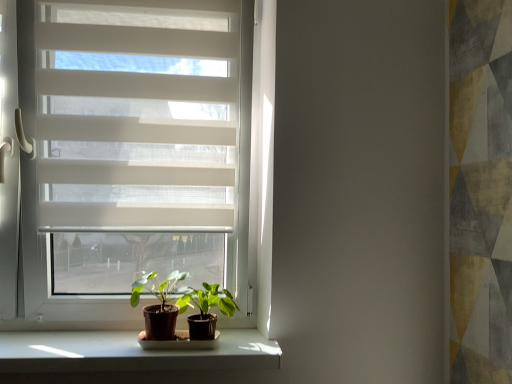
Identify the location of green matte plant at center, arranged as the second houseplant when viewed from the right. The width and height of the screenshot is (512, 384). (161, 303).

The image size is (512, 384). What do you see at coordinates (138, 119) in the screenshot? I see `white translucent blinds at upper left` at bounding box center [138, 119].

Find the location of a particular element. green matte plant at center, the second houseplant positioned from the left is located at coordinates (206, 309).

Identify the location of white matte window at center. This screenshot has height=384, width=512. (133, 155).

Where is `green matte plant at center, which is the 1th houseplant from left to right`? Image resolution: width=512 pixels, height=384 pixels. green matte plant at center, which is the 1th houseplant from left to right is located at coordinates (161, 303).

Is brown matte pot at lower center wider than white matte window at center?

No, brown matte pot at lower center is not wider than white matte window at center.

From the image's perspective, would you say brown matte pot at lower center is shown under white matte window at center?

Yes, from the image's perspective, brown matte pot at lower center is beneath white matte window at center.

There is a brown matte pot at lower center. Where is `window above it (from a real-world perspective)`? This screenshot has height=384, width=512. window above it (from a real-world perspective) is located at coordinates (133, 155).

Consider the image. Can you confirm if white smooth window sill at lower center is bigger than green matte plant at center, which is the 1th houseplant from left to right?

Yes.

Based on the photo, is white smooth window sill at lower center facing towards green matte plant at center, which is the 1th houseplant from left to right?

No, white smooth window sill at lower center is not aimed at green matte plant at center, which is the 1th houseplant from left to right.

From the white smooth window sill at lower center, count 2nd houseplants backward and point to it. Please provide its 2D coordinates.

[(161, 303)]

Is point (113, 363) positioned after point (172, 334)?

No.

Is white matte window at center looking in the opposite direction of green matte plant at center, which appears as the first houseplant when viewed from the right?

Correct, white matte window at center is looking away from green matte plant at center, which appears as the first houseplant when viewed from the right.

Between white matte window at center and green matte plant at center, the second houseplant positioned from the left, which one has larger width?

green matte plant at center, the second houseplant positioned from the left, is wider.

Does white matte window at center come behind green matte plant at center, the second houseplant positioned from the left?

Yes, white matte window at center is further from the camera.

Can you tell me how much white matte window at center and white translucent blinds at upper left differ in facing direction?

white matte window at center and white translucent blinds at upper left are facing 0.000987 degrees away from each other.

From a real-world perspective, which object rests below the other?

From a 3D spatial view, white matte window at center is below.

Is there a large distance between white matte window at center and white translucent blinds at upper left?

No, white matte window at center is not far away from white translucent blinds at upper left.

Is white matte window at center wider or thinner than white translucent blinds at upper left?

white matte window at center is wider than white translucent blinds at upper left.

Is brown matte pot at lower center completely or partially inside green matte plant at center, the second houseplant positioned from the left?

No, brown matte pot at lower center is not surrounded by green matte plant at center, the second houseplant positioned from the left.

Between green matte plant at center, which appears as the first houseplant when viewed from the right, and brown matte pot at lower center, which one appears on the right side from the viewer's perspective?

From the viewer's perspective, green matte plant at center, which appears as the first houseplant when viewed from the right, appears more on the right side.

From the image's perspective, between green matte plant at center, which appears as the first houseplant when viewed from the right, and brown matte pot at lower center, which one is located above?

green matte plant at center, which appears as the first houseplant when viewed from the right, is shown above in the image.

Considering the relative sizes of green matte plant at center, which appears as the first houseplant when viewed from the right, and brown matte pot at lower center in the image provided, is green matte plant at center, which appears as the first houseplant when viewed from the right, taller than brown matte pot at lower center?

Yes.

From a real-world perspective, is white smooth window sill at lower center above or below green matte plant at center, which appears as the first houseplant when viewed from the right?

Clearly, from a real-world perspective, white smooth window sill at lower center is below green matte plant at center, which appears as the first houseplant when viewed from the right.

Is point (217, 350) positioned in front of point (208, 323)?

Yes, it is in front of point (208, 323).

There is a white smooth window sill at lower center. Identify the location of the 1st houseplant above it (from a real-world perspective). This screenshot has height=384, width=512. (206, 309).

Measure the distance between white smooth window sill at lower center and green matte plant at center, the second houseplant positioned from the left.

white smooth window sill at lower center and green matte plant at center, the second houseplant positioned from the left, are 7.35 inches apart from each other.

From a real-world perspective, who is located higher, white smooth window sill at lower center or white matte window at center?

From a 3D spatial view, white matte window at center is above.

Image resolution: width=512 pixels, height=384 pixels. In order to click on window sill on the right of white matte window at center in this screenshot , I will do `click(132, 352)`.

Are white smooth window sill at lower center and white matte window at center beside each other?

No, white smooth window sill at lower center is not touching white matte window at center.

Does white smooth window sill at lower center contain white matte window at center?

That's incorrect, white matte window at center is not inside white smooth window sill at lower center.

Where is `window on the left of brown matte pot at lower center`? window on the left of brown matte pot at lower center is located at coordinates (133, 155).

Find the location of a particular element. The image size is (512, 384). the 2nd houseplant directly above the white smooth window sill at lower center (from a real-world perspective) is located at coordinates (161, 303).

In the scene shown: Based on their spatial positions, is white smooth window sill at lower center or white matte window at center further from green matte plant at center, which is the 1th houseplant from left to right?

white matte window at center lies further to green matte plant at center, which is the 1th houseplant from left to right, than the other object.

Looking at the image, which one is located further to green matte plant at center, which is the 1th houseplant from left to right, white smooth window sill at lower center or brown matte pot at lower center?

Among the two, white smooth window sill at lower center is located further to green matte plant at center, which is the 1th houseplant from left to right.

Looking at the image, which one is located closer to green matte plant at center, which is the 1th houseplant from left to right, brown matte pot at lower center or white smooth window sill at lower center?

Based on the image, brown matte pot at lower center appears to be nearer to green matte plant at center, which is the 1th houseplant from left to right.

Looking at this image, based on their spatial positions, is white smooth window sill at lower center or white translucent blinds at upper left further from green matte plant at center, which is the 1th houseplant from left to right?

white translucent blinds at upper left is further to green matte plant at center, which is the 1th houseplant from left to right.

Estimate the real-world distances between objects in this image. Which object is further from white smooth window sill at lower center, white translucent blinds at upper left or green matte plant at center, the second houseplant positioned from the left?

white translucent blinds at upper left is positioned further to the anchor white smooth window sill at lower center.

Considering their positions, is white translucent blinds at upper left positioned further to green matte plant at center, arranged as the second houseplant when viewed from the right, than white smooth window sill at lower center?

white translucent blinds at upper left lies further to green matte plant at center, arranged as the second houseplant when viewed from the right, than the other object.

From the image, which object appears to be nearer to green matte plant at center, which appears as the first houseplant when viewed from the right, white matte window at center or green matte plant at center, arranged as the second houseplant when viewed from the right?

green matte plant at center, arranged as the second houseplant when viewed from the right, lies closer to green matte plant at center, which appears as the first houseplant when viewed from the right, than the other object.

When comparing their distances from green matte plant at center, arranged as the second houseplant when viewed from the right, does green matte plant at center, the second houseplant positioned from the left, or white translucent blinds at upper left seem further?

white translucent blinds at upper left.

Locate an element on the screen. The height and width of the screenshot is (384, 512). shelf between white smooth window sill at lower center and green matte plant at center, the second houseplant positioned from the left is located at coordinates (178, 342).

Image resolution: width=512 pixels, height=384 pixels. I want to click on houseplant between white translucent blinds at upper left and green matte plant at center, which appears as the first houseplant when viewed from the right, vertically, so click(161, 303).

Find the location of a particular element. The height and width of the screenshot is (384, 512). window that lies between white translucent blinds at upper left and white smooth window sill at lower center from top to bottom is located at coordinates (133, 155).

Identify the location of window between white translucent blinds at upper left and green matte plant at center, arranged as the second houseplant when viewed from the right, from top to bottom. (133, 155).